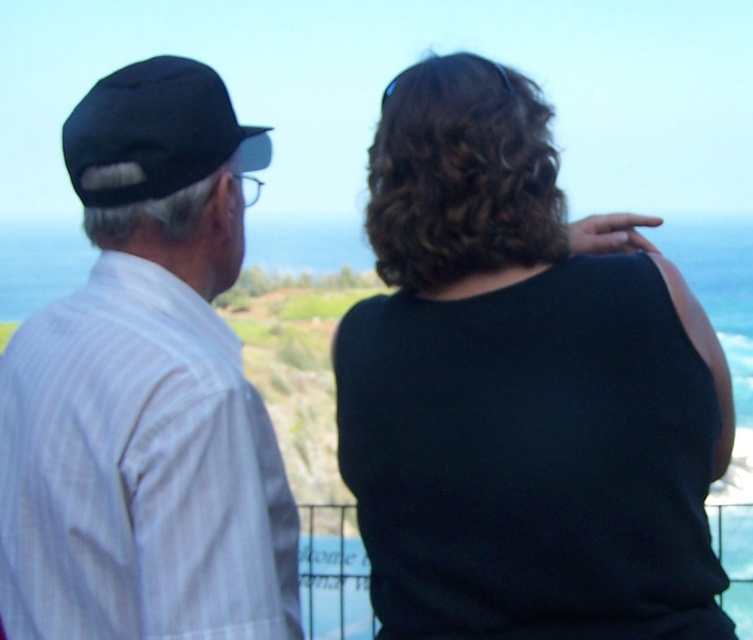
Is point (747, 570) positioned behind point (178, 176)?

Yes, it is behind point (178, 176).

This screenshot has height=640, width=753. What do you see at coordinates (306, 394) in the screenshot?
I see `blue water at upper center` at bounding box center [306, 394].

Where is `blue water at upper center`? The width and height of the screenshot is (753, 640). blue water at upper center is located at coordinates (306, 394).

Locate an element on the screen. The width and height of the screenshot is (753, 640). blue water at upper center is located at coordinates (306, 394).

The image size is (753, 640). Describe the element at coordinates (523, 388) in the screenshot. I see `black matte shirt at upper right` at that location.

Does black matte shirt at upper right appear over blue water at upper center?

No.

Where is `black matte shirt at upper right`? The image size is (753, 640). black matte shirt at upper right is located at coordinates (523, 388).

Locate an element on the screen. The image size is (753, 640). white striped shirt at left is located at coordinates (145, 392).

Can you confirm if white striped shirt at left is positioned below blue water at upper center?

Indeed, white striped shirt at left is positioned under blue water at upper center.

Who is more distant from viewer, (130, 168) or (288, 392)?

The point (288, 392) is more distant.

The image size is (753, 640). What are the coordinates of `white striped shirt at left` in the screenshot? It's located at (145, 392).